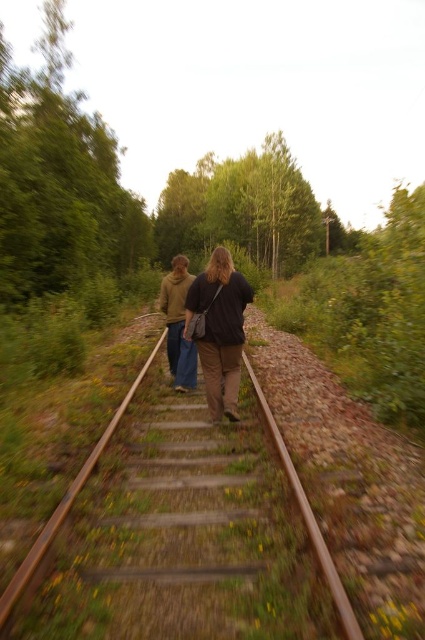
Find the location of a particular element. rusty metal train track at center is located at coordinates (180, 532).

Find the location of a particular element. The height and width of the screenshot is (640, 425). rusty metal train track at center is located at coordinates (180, 532).

At what (x,y) coordinates should I click in order to perform the action: click on rusty metal train track at center. Please return your answer as a coordinate pair (x, y). This screenshot has width=425, height=640. Looking at the image, I should click on (180, 532).

Is dark brown leather jacket at center below brown cotton hoodie at center?

Correct, dark brown leather jacket at center is located below brown cotton hoodie at center.

Can you confirm if dark brown leather jacket at center is positioned above brown cotton hoodie at center?

No.

Is point (218, 349) more distant than point (181, 312)?

No, (218, 349) is in front of (181, 312).

Image resolution: width=425 pixels, height=640 pixels. Identify the location of dark brown leather jacket at center. (220, 330).

Based on the photo, is rusty metal train track at center below dark brown leather jacket at center?

Indeed, rusty metal train track at center is positioned under dark brown leather jacket at center.

Who is shorter, rusty metal train track at center or dark brown leather jacket at center?

Standing shorter between the two is rusty metal train track at center.

Between point (115, 451) and point (223, 298), which one is positioned behind?

Positioned behind is point (223, 298).

Image resolution: width=425 pixels, height=640 pixels. I want to click on rusty metal train track at center, so click(x=180, y=532).